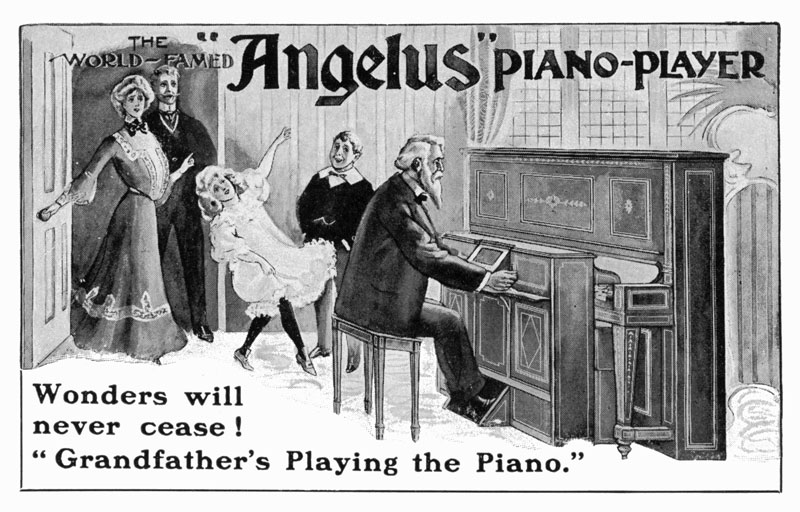
Locate an element on the screen. The height and width of the screenshot is (512, 800). bench is located at coordinates (376, 381).